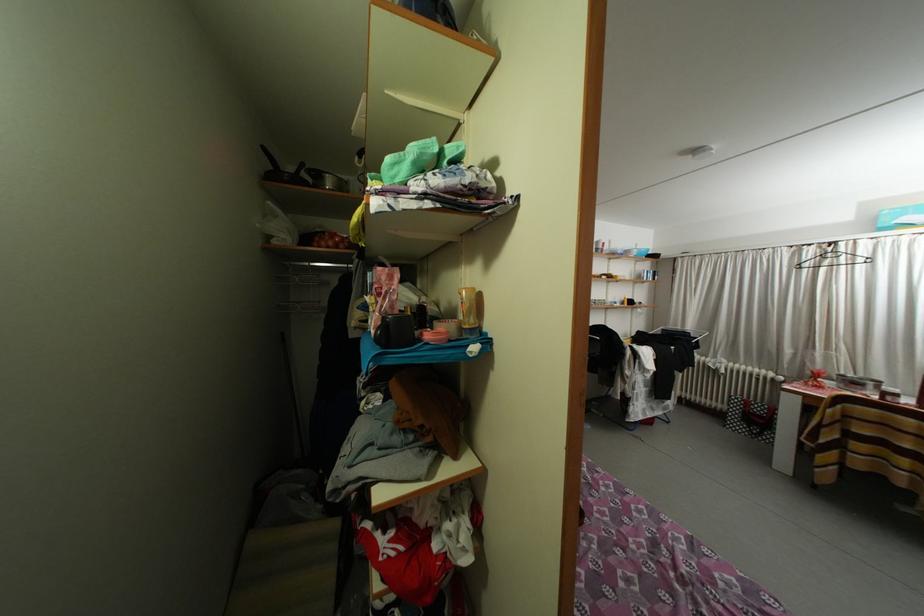
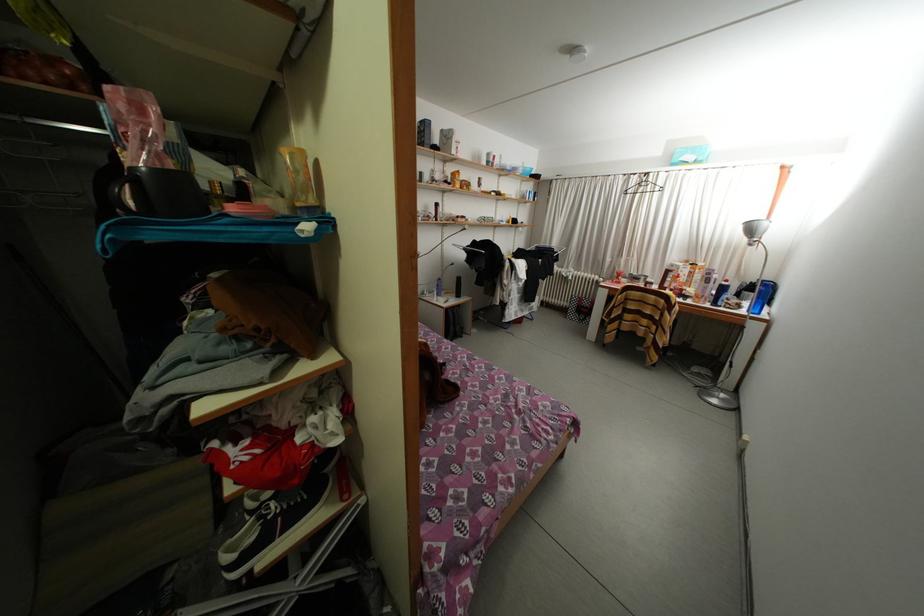
Locate, in the second image, the point that corresponds to (x=808, y=254) in the first image.

(638, 184)